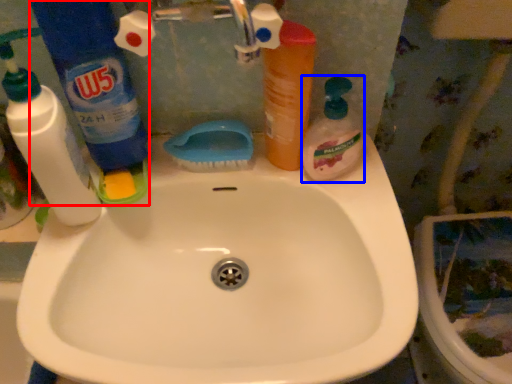
Question: Which object appears closest to the camera in this image, cleaning product (highlighted by a red box) or cleaning product (highlighted by a blue box)?

Choices:
 (A) cleaning product
 (B) cleaning product

Answer: (A)